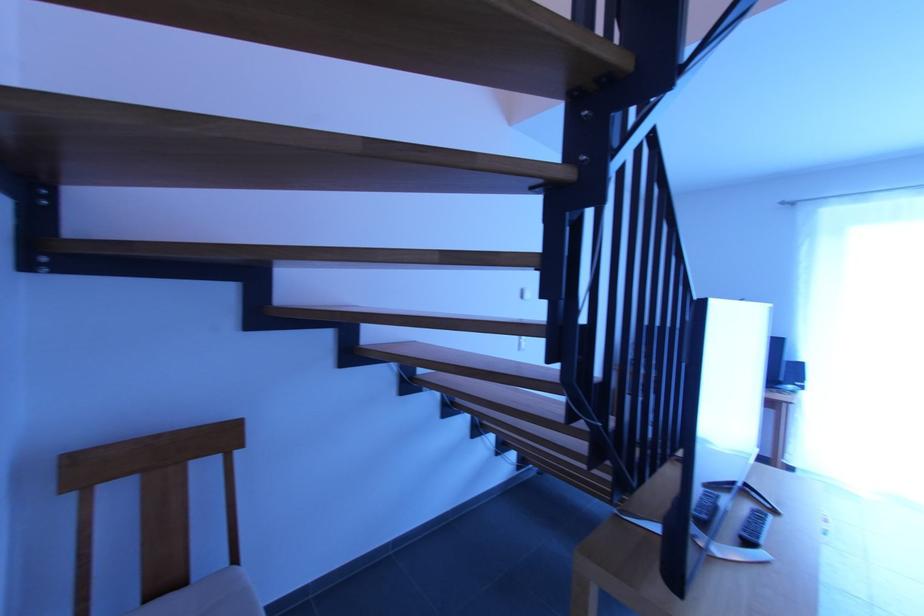
Where would you grasp the black stair handrail? Please return your answer as a coordinate pair (x, y).

(636, 198)